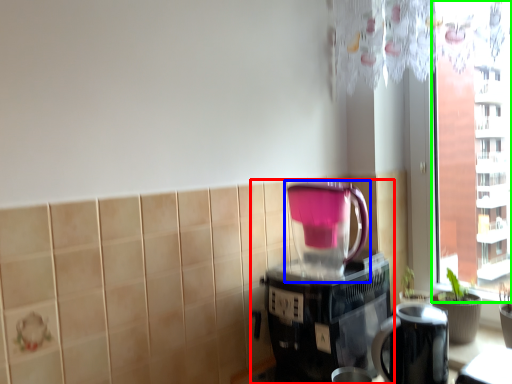
Question: Which is farther away from coffee maker (highlighted by a red box)? blender (highlighted by a blue box) or window screen (highlighted by a green box)?

Choices:
 (A) blender
 (B) window screen

Answer: (B)